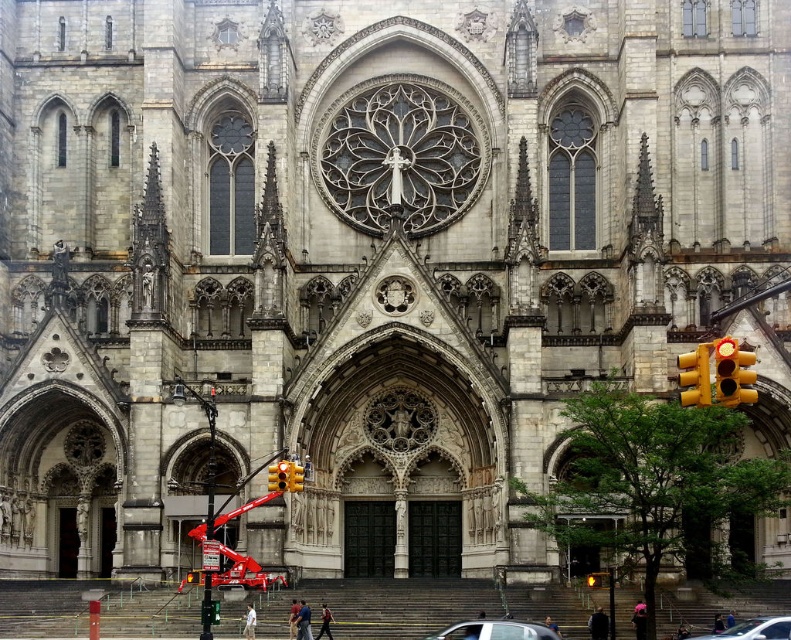
Question: Is yellow plastic traffic light at right smaller than yellow plastic traffic light at center right?

Choices:
 (A) yes
 (B) no

Answer: (B)

Question: Which point is farther from the camera taking this photo?

Choices:
 (A) (294, 490)
 (B) (693, 378)
 (C) (725, 634)

Answer: (A)

Question: Which of the following is the farthest from the observer?

Choices:
 (A) metallic silver car at lower right
 (B) silver metallic car at center
 (C) yellow plastic traffic light at center

Answer: (C)

Question: Which point is closer to the camera?

Choices:
 (A) metallic silver car at lower right
 (B) silver metallic car at center
 (C) yellow plastic traffic light at center
 (D) yellow plastic traffic light at right

Answer: (A)

Question: Does metallic silver car at lower right have a larger size compared to yellow plastic traffic light at center?

Choices:
 (A) no
 (B) yes

Answer: (B)

Question: Does silver metallic car at center appear over metallic silver car at lower right?

Choices:
 (A) no
 (B) yes

Answer: (A)